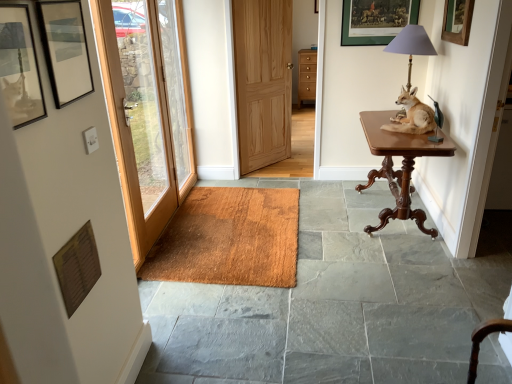
Find the location of `empty space that is in between mahogany wood table at right and brown textured mat at center`. empty space that is in between mahogany wood table at right and brown textured mat at center is located at coordinates (334, 228).